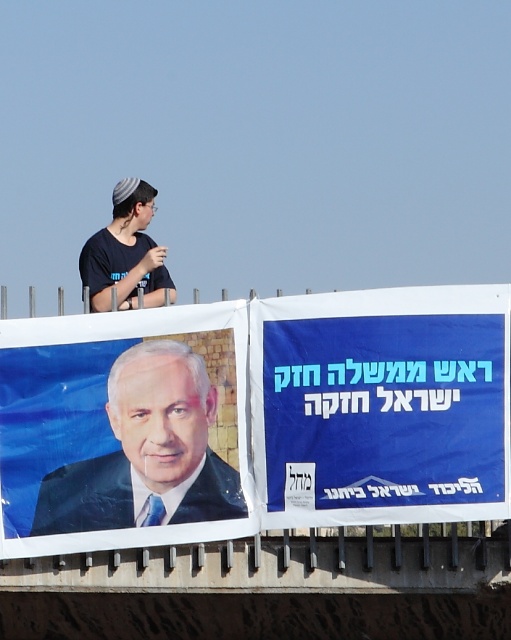
You are a campaign manager trying to place a new sticker on the billboard. The sticker needs to be placed to the right of the blue fabric poster at upper center. Where should you place it?

The blue fabric poster at upper center is located at coordinates point (257, 419). To place the sticker to the right of it, you should position it at a point with an x coordinate greater than 0.656 and the same y coordinate, 0.503.

You are standing at the point labeled point (340, 497) and want to take a photo of the political campaign billboard. The camera you are using has a maximum zoom range of 40 meters. Will you be able to capture the entire billboard in your photo without moving closer?

The distance between point (340, 497) and the camera is 42.07 meters. Since the camera can only zoom up to 40 meters, you will not be able to capture the entire billboard without moving closer.